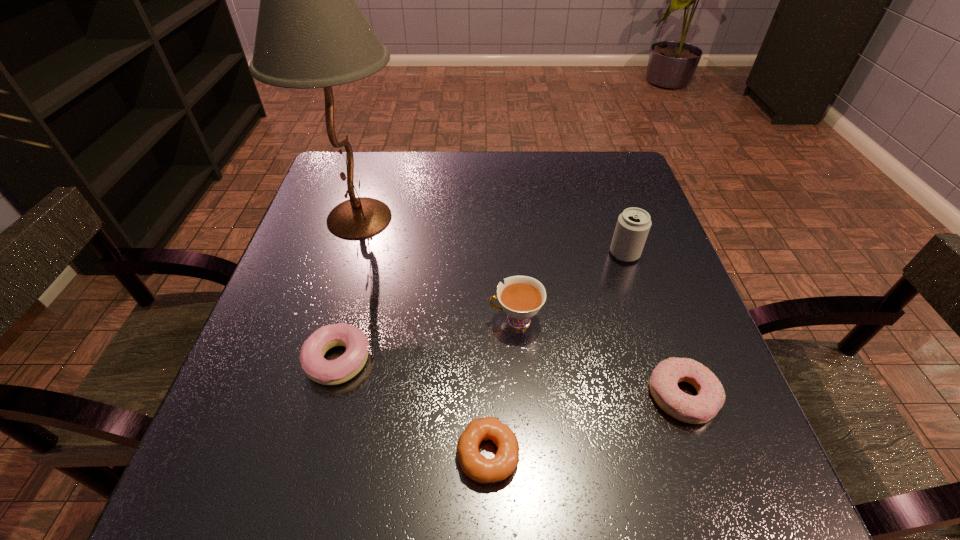
Locate an element on the screen. blank area located on the side of the teacup with the handle is located at coordinates (463, 320).

Find the location of `free spot located on the front of the leftmost doughnut`. free spot located on the front of the leftmost doughnut is located at coordinates (298, 515).

Find the location of `free space located on the left of the rightmost doughnut`. free space located on the left of the rightmost doughnut is located at coordinates (618, 396).

You are a GUI agent. You are given a task and a screenshot of the screen. Output one action in this format:
    pyautogui.click(x=<x>, y=<y>)
    Task: Click on the free space located on the right of the second doughnut from right to left
    The width and height of the screenshot is (960, 540).
    Given the screenshot: What is the action you would take?
    pyautogui.click(x=618, y=455)

Identify the location of object positioned at the far edge. The height and width of the screenshot is (540, 960). (311, 33).

Locate an element on the screen. This screenshot has width=960, height=540. object at the near edge is located at coordinates (478, 468).

Identify the location of table lamp that is positioned at the left edge. (311, 33).

Locate an element on the screen. The image size is (960, 540). doughnut present at the left edge is located at coordinates (327, 372).

Where is `can positioned at the right edge`? This screenshot has width=960, height=540. can positioned at the right edge is located at coordinates (633, 224).

Where is `doughnut that is positioned at the right edge`? This screenshot has height=540, width=960. doughnut that is positioned at the right edge is located at coordinates (710, 398).